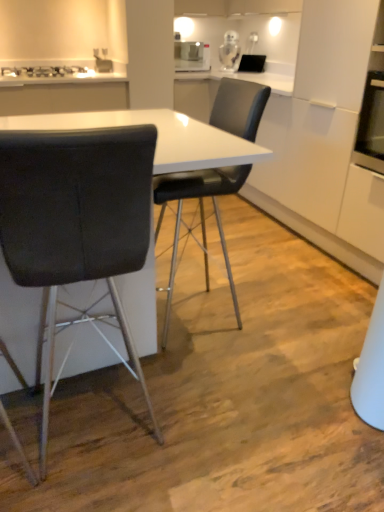
The height and width of the screenshot is (512, 384). Describe the element at coordinates (77, 223) in the screenshot. I see `black leather chair at left, which is counted as the first chair, starting from the left` at that location.

In order to face white glossy table at center, should I rotate leftwards or rightwards?

You should look left and rotate roughly 12.050 degrees.

Measure the distance between point (219, 86) and camera.

1.88 meters.

What is the approximate height of black leather chair at center, which ranks as the 2th chair in left-to-right order?

It is 3.59 feet.

This screenshot has width=384, height=512. Describe the element at coordinates (229, 50) in the screenshot. I see `clear glass jar at upper center, which is counted as the 1th appliance, starting from the right` at that location.

The width and height of the screenshot is (384, 512). Identify the location of metallic silver gas stove at upper left. (43, 72).

Which of these two, black leather chair at left, which is the second chair in right-to-left order, or black leather chair at center, which is the 1th chair from right to left, is thinner?

With smaller width is black leather chair at left, which is the second chair in right-to-left order.

How distant is black leather chair at left, which is the second chair in right-to-left order, from black leather chair at center, which is the 1th chair from right to left?

They are 30.13 inches apart.

Is black leather chair at left, which is the second chair in right-to-left order, positioned with its back to black leather chair at center, which is the 1th chair from right to left?

That's not correct — black leather chair at left, which is the second chair in right-to-left order, is not looking away from black leather chair at center, which is the 1th chair from right to left.

Would you say black leather chair at left, which is counted as the first chair, starting from the left, is inside or outside black leather chair at center, which is the 1th chair from right to left?

black leather chair at left, which is counted as the first chair, starting from the left, is spatially situated outside black leather chair at center, which is the 1th chair from right to left.

From the image's perspective, is clear glass jar at upper center, which is counted as the 1th appliance, starting from the right, under metallic silver gas stove at upper left?

No, from the image's perspective, clear glass jar at upper center, which is counted as the 1th appliance, starting from the right, is not below metallic silver gas stove at upper left.

Would you say clear glass jar at upper center, placed as the 2th appliance when sorted from left to right, is inside or outside metallic silver gas stove at upper left?

clear glass jar at upper center, placed as the 2th appliance when sorted from left to right, is not enclosed by metallic silver gas stove at upper left.

Which of these two, clear glass jar at upper center, placed as the 2th appliance when sorted from left to right, or metallic silver gas stove at upper left, is smaller?

Smaller between the two is clear glass jar at upper center, placed as the 2th appliance when sorted from left to right.

Where is `the 2nd chair below the metallic silver gas stove at upper left (from the image's perspective)`? the 2nd chair below the metallic silver gas stove at upper left (from the image's perspective) is located at coordinates (77, 223).

Is metallic silver gas stove at upper left with black leather chair at left, which is the second chair in right-to-left order?

No.

Based on the photo, how many degrees apart are the facing directions of metallic silver gas stove at upper left and black leather chair at left, which is counted as the first chair, starting from the left?

178 degrees separate the facing orientations of metallic silver gas stove at upper left and black leather chair at left, which is counted as the first chair, starting from the left.

Can you confirm if metallic silver gas stove at upper left is taller than black leather chair at left, which is counted as the first chair, starting from the left?

Incorrect, the height of metallic silver gas stove at upper left is not larger of that of black leather chair at left, which is counted as the first chair, starting from the left.

Is black leather chair at left, which is counted as the first chair, starting from the left, not near metallic silver gas stove at upper left?

black leather chair at left, which is counted as the first chair, starting from the left, is far away from metallic silver gas stove at upper left.

Is black leather chair at left, which is counted as the first chair, starting from the left, positioned with its back to metallic silver gas stove at upper left?

That's not correct — black leather chair at left, which is counted as the first chair, starting from the left, is not looking away from metallic silver gas stove at upper left.

Considering the sizes of black leather chair at left, which is the second chair in right-to-left order, and metallic silver gas stove at upper left in the image, is black leather chair at left, which is the second chair in right-to-left order, wider or thinner than metallic silver gas stove at upper left?

Clearly, black leather chair at left, which is the second chair in right-to-left order, has more width compared to metallic silver gas stove at upper left.

Does black leather chair at center, which is the 1th chair from right to left, have a smaller size compared to metallic silver gas stove at upper left?

Actually, black leather chair at center, which is the 1th chair from right to left, might be larger than metallic silver gas stove at upper left.

There is a black leather chair at center, which ranks as the 2th chair in left-to-right order. Find the location of `gas stove above it (from a real-world perspective)`. gas stove above it (from a real-world perspective) is located at coordinates (43, 72).

Which is behind, point (205, 182) or point (10, 71)?

The point (10, 71) is more distant.

Is black leather chair at center, which is the 1th chair from right to left, taller or shorter than black leather chair at left, which is the second chair in right-to-left order?

black leather chair at center, which is the 1th chair from right to left, is taller than black leather chair at left, which is the second chair in right-to-left order.

Which object is more forward, black leather chair at center, which ranks as the 2th chair in left-to-right order, or black leather chair at left, which is counted as the first chair, starting from the left?

black leather chair at left, which is counted as the first chair, starting from the left, is closer to the camera.

Does black leather chair at center, which is the 1th chair from right to left, turn towards black leather chair at left, which is counted as the first chair, starting from the left?

No, black leather chair at center, which is the 1th chair from right to left, is not oriented towards black leather chair at left, which is counted as the first chair, starting from the left.

Looking at this image, who is bigger, black leather chair at center, which is the 1th chair from right to left, or black leather chair at left, which is the second chair in right-to-left order?

black leather chair at center, which is the 1th chair from right to left.

Is black leather chair at left, which is the second chair in right-to-left order, beside clear glass jar at upper center, which is counted as the 1th appliance, starting from the right?

No, black leather chair at left, which is the second chair in right-to-left order, is not in contact with clear glass jar at upper center, which is counted as the 1th appliance, starting from the right.

From the image's perspective, between black leather chair at left, which is the second chair in right-to-left order, and clear glass jar at upper center, placed as the 2th appliance when sorted from left to right, which one is located above?

clear glass jar at upper center, placed as the 2th appliance when sorted from left to right, appears higher in the image.

Is black leather chair at left, which is counted as the first chair, starting from the left, at the left side of clear glass jar at upper center, which is counted as the 1th appliance, starting from the right?

Indeed, black leather chair at left, which is counted as the first chair, starting from the left, is positioned on the left side of clear glass jar at upper center, which is counted as the 1th appliance, starting from the right.

From a real-world perspective, relative to clear glass jar at upper center, which is counted as the 1th appliance, starting from the right, is black leather chair at left, which is the second chair in right-to-left order, vertically above or below?

Clearly, from a real-world perspective, black leather chair at left, which is the second chair in right-to-left order, is below clear glass jar at upper center, which is counted as the 1th appliance, starting from the right.

Locate an element on the screen. This screenshot has height=512, width=384. chair lying below the black leather chair at center, which is the 1th chair from right to left (from the image's perspective) is located at coordinates (77, 223).

From a real-world perspective, starting from the metallic silver gas stove at upper left, which appliance is the 2nd one vertically above it? Please provide its 2D coordinates.

[(229, 50)]

Considering their positions, is clear glass jar at upper center, placed as the 2th appliance when sorted from left to right, positioned closer to black leather chair at left, which is counted as the first chair, starting from the left, than white glossy toaster at upper center, marked as the first appliance in a left-to-right arrangement?

The object closer to black leather chair at left, which is counted as the first chair, starting from the left, is white glossy toaster at upper center, marked as the first appliance in a left-to-right arrangement.

Based on the photo, when comparing their distances from clear glass jar at upper center, which is counted as the 1th appliance, starting from the right, does white glossy table at center or black leather chair at center, which ranks as the 2th chair in left-to-right order, seem further?

white glossy table at center.

In the scene shown: From the image, which object appears to be nearer to white glossy table at center, black leather chair at center, which ranks as the 2th chair in left-to-right order, or white glossy toaster at upper center, marked as the 2th appliance in a right-to-left arrangement?

A: black leather chair at center, which ranks as the 2th chair in left-to-right order.

Which object lies further to the anchor point white glossy toaster at upper center, marked as the first appliance in a left-to-right arrangement, black leather chair at left, which is the second chair in right-to-left order, or black leather chair at center, which is the 1th chair from right to left?

Based on the image, black leather chair at left, which is the second chair in right-to-left order, appears to be further to white glossy toaster at upper center, marked as the first appliance in a left-to-right arrangement.

In the scene shown: Looking at the image, which one is located closer to black leather chair at center, which is the 1th chair from right to left, black leather chair at left, which is the second chair in right-to-left order, or clear glass jar at upper center, which is counted as the 1th appliance, starting from the right?

black leather chair at left, which is the second chair in right-to-left order, is closer to black leather chair at center, which is the 1th chair from right to left.

When comparing their distances from white glossy table at center, does white glossy toaster at upper center, marked as the first appliance in a left-to-right arrangement, or metallic silver gas stove at upper left seem further?

white glossy toaster at upper center, marked as the first appliance in a left-to-right arrangement, lies further to white glossy table at center than the other object.

Based on their spatial positions, is clear glass jar at upper center, placed as the 2th appliance when sorted from left to right, or white glossy table at center closer to black leather chair at left, which is the second chair in right-to-left order?

white glossy table at center.

Considering their positions, is white glossy table at center positioned closer to metallic silver gas stove at upper left than black leather chair at center, which ranks as the 2th chair in left-to-right order?

black leather chair at center, which ranks as the 2th chair in left-to-right order, is positioned closer to the anchor metallic silver gas stove at upper left.

This screenshot has height=512, width=384. Identify the location of chair positioned between black leather chair at left, which is counted as the first chair, starting from the left, and white glossy toaster at upper center, marked as the first appliance in a left-to-right arrangement, from near to far. (200, 217).

Find the location of a particular element. chair positioned between black leather chair at left, which is the second chair in right-to-left order, and clear glass jar at upper center, which is counted as the 1th appliance, starting from the right, from near to far is located at coordinates (200, 217).

The image size is (384, 512). I want to click on table between black leather chair at left, which is counted as the first chair, starting from the left, and metallic silver gas stove at upper left from front to back, so click(157, 137).

The image size is (384, 512). What are the coordinates of `chair between white glossy table at center and metallic silver gas stove at upper left from front to back` in the screenshot? It's located at (200, 217).